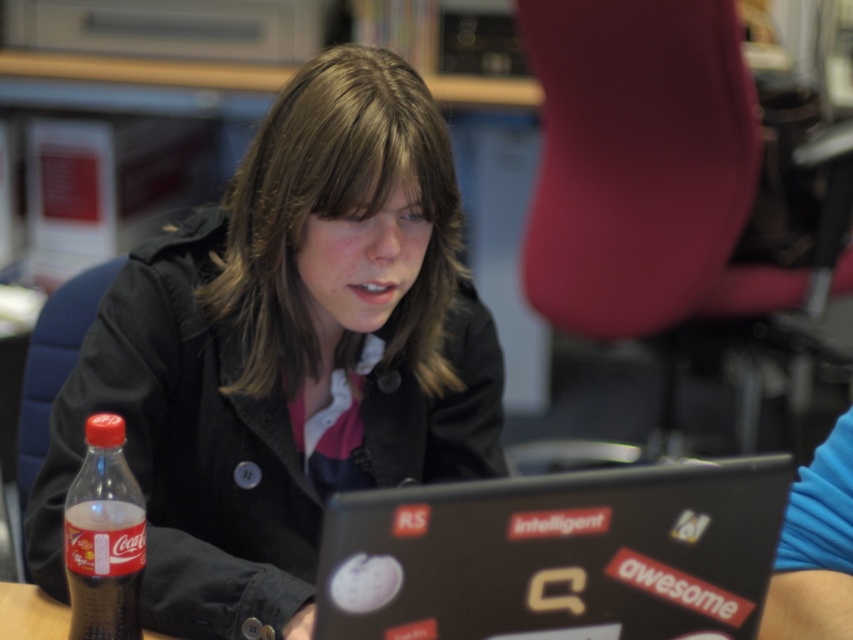
Question: Which is farther from the black matte jacket at center?

Choices:
 (A) brown wooden table at lower left
 (B) translucent plastic bottle at lower left
 (C) black matte laptop at center

Answer: (C)

Question: Is translucent plastic bottle at lower left positioned at the back of brown wooden table at lower left?

Choices:
 (A) no
 (B) yes

Answer: (A)

Question: Can you confirm if black matte jacket at center is wider than brown wooden table at lower left?

Choices:
 (A) no
 (B) yes

Answer: (B)

Question: Does black matte jacket at center come in front of translucent plastic bottle at lower left?

Choices:
 (A) no
 (B) yes

Answer: (A)

Question: Estimate the real-world distances between objects in this image. Which object is closer to the translucent plastic bottle at lower left?

Choices:
 (A) black matte jacket at center
 (B) black matte laptop at center

Answer: (A)

Question: Which object is the farthest from the translucent plastic bottle at lower left?

Choices:
 (A) black matte laptop at center
 (B) brown wooden table at lower left
 (C) black matte jacket at center

Answer: (A)